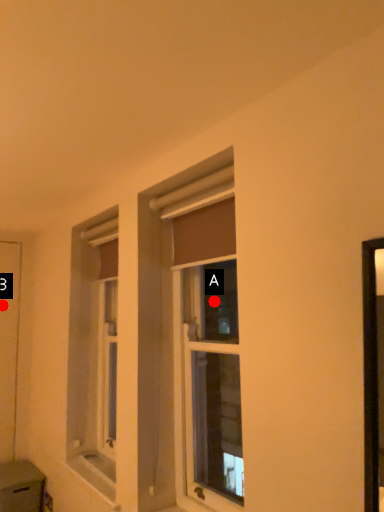
Question: Two points are circled on the image, labeled by A and B beside each circle. Among these points, which one is nearest to the camera?

Choices:
 (A) A is closer
 (B) B is closer

Answer: (A)